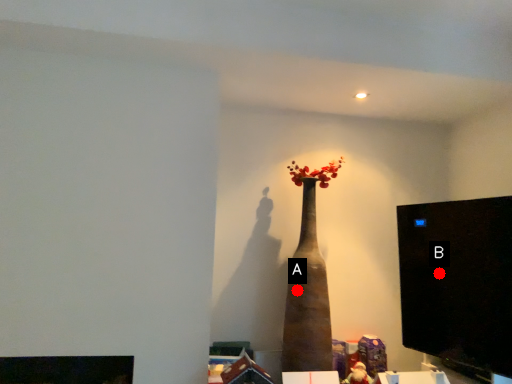
Question: Two points are circled on the image, labeled by A and B beside each circle. Which point appears closest to the camera in this image?

Choices:
 (A) A is closer
 (B) B is closer

Answer: (A)